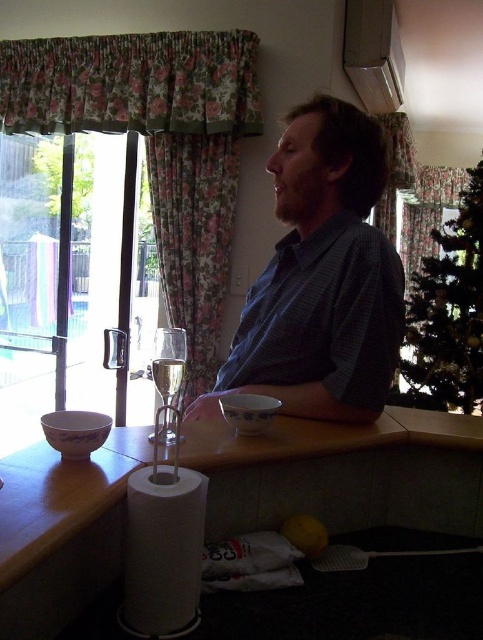
Who is more distant from viewer, (186, 525) or (168, 374)?

The point (168, 374) is behind.

Is white paper towel at lower left shorter than clear glass champagne flute at center?

Incorrect, white paper towel at lower left's height does not fall short of clear glass champagne flute at center's.

Which is behind, point (173, 566) or point (164, 360)?

The point (164, 360) is more distant.

Identify the location of white paper towel at lower left. (162, 548).

Can you confirm if transparent glass door at left is smaller than clear glass wine glass at center?

No.

Does transparent glass door at left appear on the right side of clear glass wine glass at center?

Incorrect, transparent glass door at left is not on the right side of clear glass wine glass at center.

Which is behind, point (55, 310) or point (184, 333)?

Positioned behind is point (55, 310).

Where is `transparent glass door at left`? transparent glass door at left is located at coordinates (74, 282).

This screenshot has width=483, height=640. What are the coordinates of `white paper towel at lower left` in the screenshot? It's located at (162, 548).

How distant is white paper towel at lower left from clear glass wine glass at center?

white paper towel at lower left and clear glass wine glass at center are 6.78 inches apart from each other.

Between point (169, 483) and point (161, 394), which one is positioned in front?

Point (169, 483) is more forward.

Find the location of a particular element. The height and width of the screenshot is (640, 483). white paper towel at lower left is located at coordinates (162, 548).